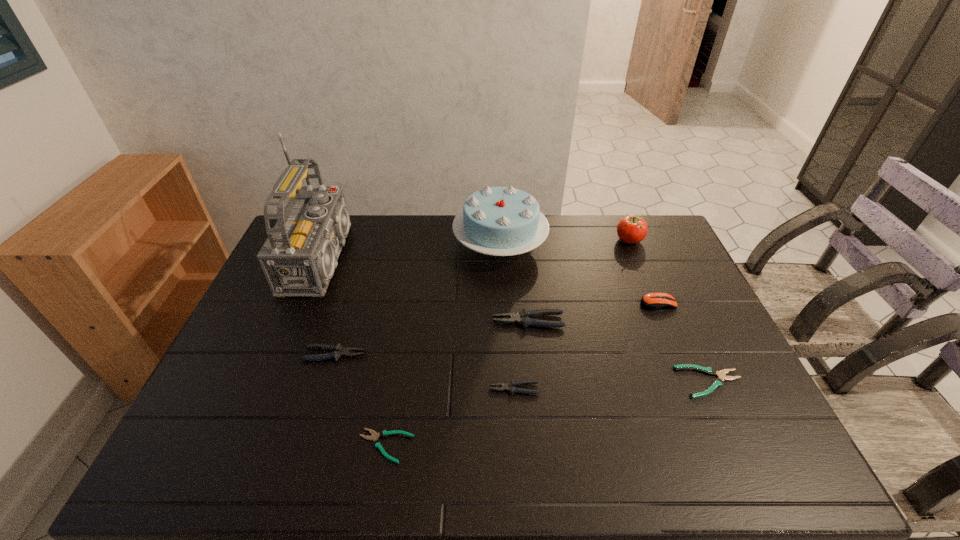
At what (x,y) coordinates should I click in order to perform the action: click on free space located on the right of the second pliers from left to right. Please return your answer as a coordinate pair (x, y). The image size is (960, 540). Looking at the image, I should click on (513, 446).

This screenshot has height=540, width=960. I want to click on radio receiver situated at the far edge, so click(299, 257).

Where is `birthday cake at the far edge`? The image size is (960, 540). birthday cake at the far edge is located at coordinates (501, 221).

Locate an element on the screen. The width and height of the screenshot is (960, 540). tomato present at the far edge is located at coordinates (631, 229).

Identify the location of object that is at the near edge. (377, 443).

You are a GUI agent. You are given a task and a screenshot of the screen. Output one action in this format:
    pyautogui.click(x=<x>, y=<y>)
    Task: Click on the object that is at the left edge
    The height and width of the screenshot is (540, 960).
    Given the screenshot: What is the action you would take?
    tap(299, 257)

At what (x,y) coordinates should I click in order to perform the action: click on tomato that is at the right edge. Please return your answer as a coordinate pair (x, y). The width and height of the screenshot is (960, 540). Looking at the image, I should click on (631, 229).

Find the location of a particular element. The height and width of the screenshot is (540, 960). computer mouse at the right edge is located at coordinates (652, 301).

I want to click on pliers present at the right edge, so click(718, 382).

I want to click on object positioned at the far left corner, so click(x=299, y=257).